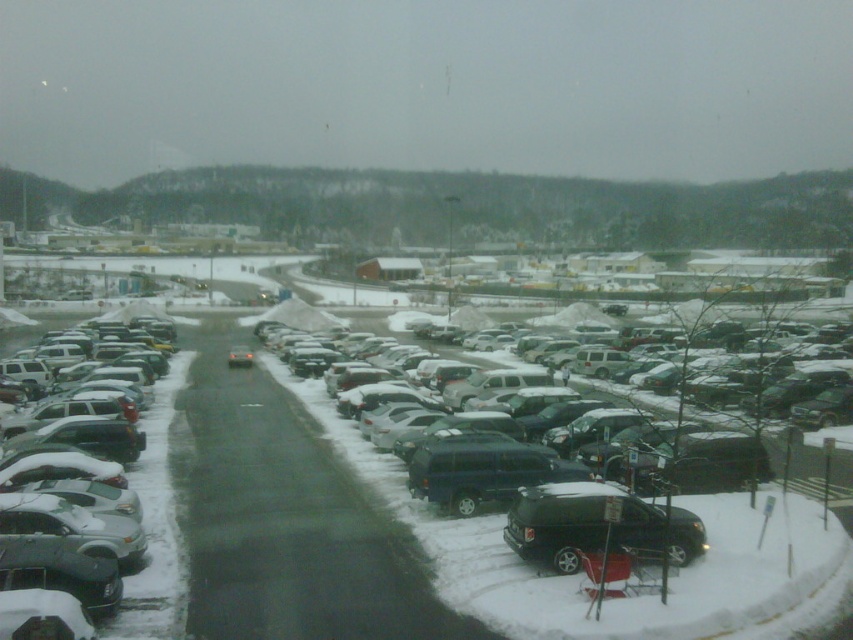
Between snow-covered cars at center and sleek silver sedan at left, which one appears on the right side from the viewer's perspective?

snow-covered cars at center

Is snow-covered cars at center positioned in front of sleek silver sedan at left?

Yes, snow-covered cars at center is closer to the viewer.

Does point (201, 448) lie in front of point (132, 468)?

No.

Locate an element on the screen. The width and height of the screenshot is (853, 640). snow-covered cars at center is located at coordinates (267, 520).